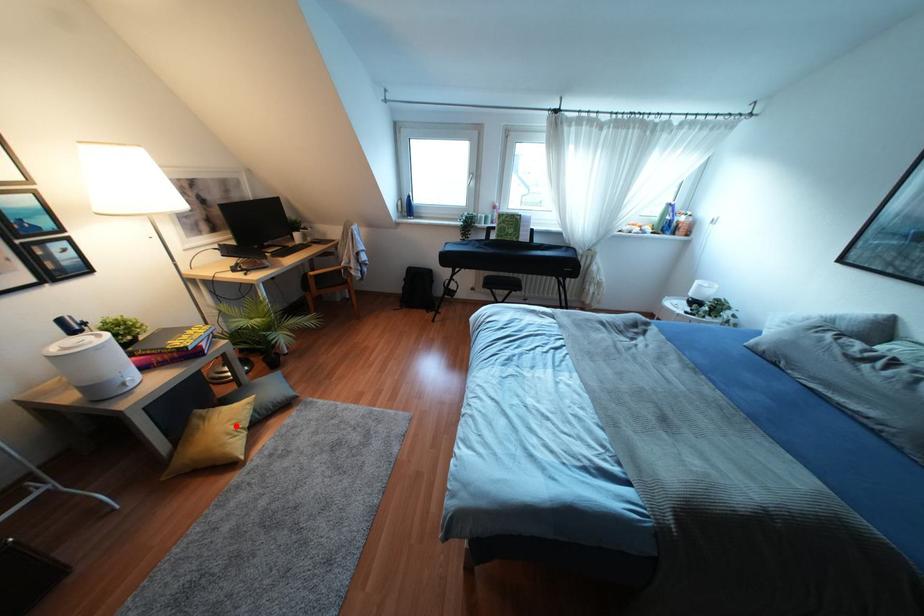
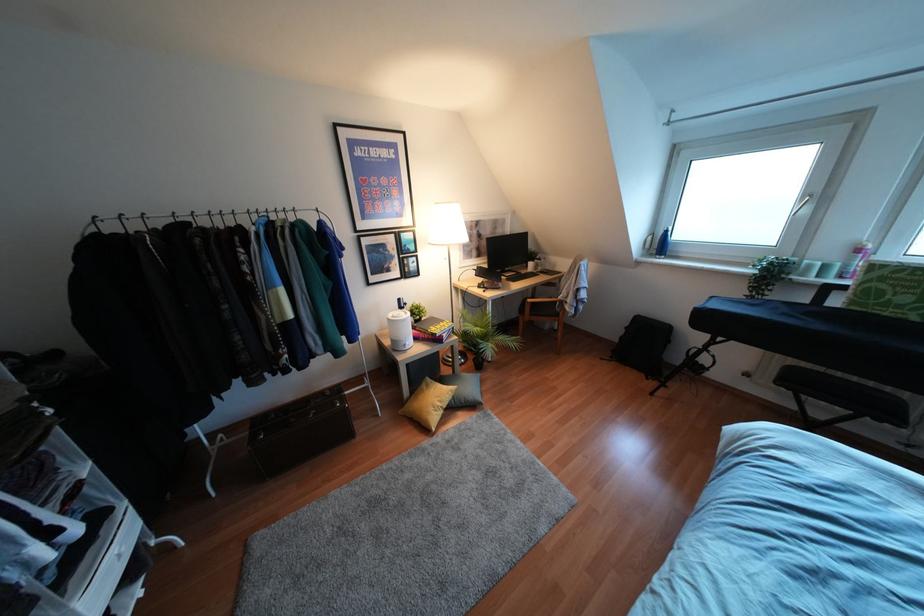
Find the pixel in the second image that matches the highlighted location in the first image.

(439, 403)